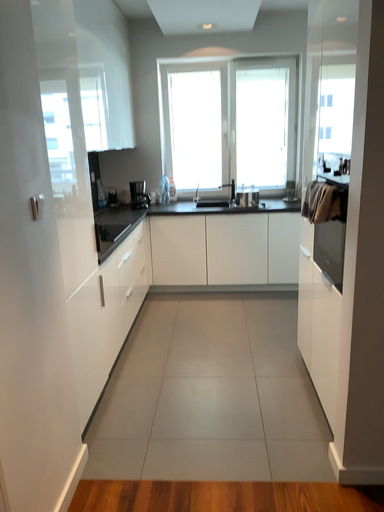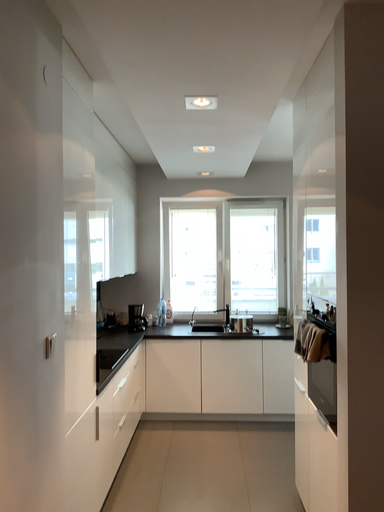
Question: How did the camera likely rotate when shooting the video?

Choices:
 (A) rotated upward
 (B) rotated downward

Answer: (A)